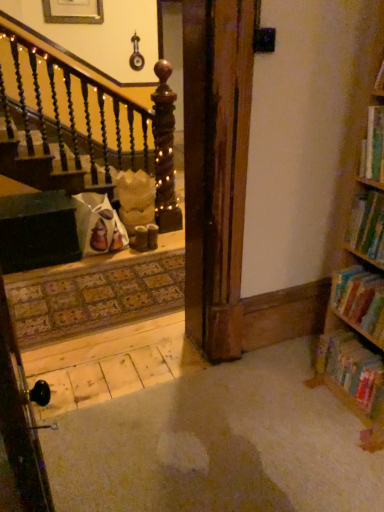
In order to face multicolored cardboard book at lower right, which is the 4th book from top to bottom, should I rotate leftwards or rightwards?

You should look right and rotate roughly 21.259 degrees.

What do you see at coordinates (367, 225) in the screenshot?
I see `green matte bookshelf at right, which is the third book from bottom to top` at bounding box center [367, 225].

Image resolution: width=384 pixels, height=512 pixels. Identify the location of multicolored cardboard book at lower right, arranged as the first book when ordered from the bottom. (351, 368).

The height and width of the screenshot is (512, 384). In order to click on book lying above the green matte bookshelf at right, which ranks as the second book in top-to-bottom order (from the image's perspective) in this screenshot , I will do `click(373, 146)`.

Who is shorter, hardcover book at upper right, the 4th book when ordered from bottom to top, or green matte bookshelf at right, which ranks as the second book in top-to-bottom order?

green matte bookshelf at right, which ranks as the second book in top-to-bottom order.

Could you measure the distance between hardcover book at upper right, the 4th book when ordered from bottom to top, and green matte bookshelf at right, which ranks as the second book in top-to-bottom order?

hardcover book at upper right, the 4th book when ordered from bottom to top, is 6.85 inches away from green matte bookshelf at right, which ranks as the second book in top-to-bottom order.

Which object is wider, hardcover book at upper right, the 4th book when ordered from bottom to top, or multicolored cardboard book at lower right, which is the 4th book from top to bottom?

multicolored cardboard book at lower right, which is the 4th book from top to bottom, is wider.

Would you say hardcover book at upper right, the 1th book viewed from the top, is a long distance from multicolored cardboard book at lower right, which is the 4th book from top to bottom?

They are positioned close to each other.

Is hardcover book at upper right, the 1th book viewed from the top, facing towards multicolored cardboard book at lower right, arranged as the first book when ordered from the bottom?

No, hardcover book at upper right, the 1th book viewed from the top, is not turned towards multicolored cardboard book at lower right, arranged as the first book when ordered from the bottom.

From the image's perspective, between hardcover book at upper right, the 1th book viewed from the top, and multicolored cardboard book at lower right, which is the 4th book from top to bottom, which one is located above?

hardcover book at upper right, the 1th book viewed from the top, from the image's perspective.

From a real-world perspective, is multicolored cardboard book at lower right, arranged as the first book when ordered from the bottom, beneath green matte bookshelf at right, which ranks as the second book in top-to-bottom order?

Indeed, from a real-world perspective, multicolored cardboard book at lower right, arranged as the first book when ordered from the bottom, is positioned beneath green matte bookshelf at right, which ranks as the second book in top-to-bottom order.

Is green matte bookshelf at right, which ranks as the second book in top-to-bottom order, completely or partially inside multicolored cardboard book at lower right, arranged as the first book when ordered from the bottom?

No, green matte bookshelf at right, which ranks as the second book in top-to-bottom order, is not inside multicolored cardboard book at lower right, arranged as the first book when ordered from the bottom.

Considering the points (342, 352) and (375, 200), which point is behind, point (342, 352) or point (375, 200)?

The point (342, 352) is farther.

Is green matte bookshelf at right, which ranks as the second book in top-to-bottom order, at the back of hardcover book at right, marked as the second book in a bottom-to-top arrangement?

hardcover book at right, marked as the second book in a bottom-to-top arrangement, does not have its back to green matte bookshelf at right, which ranks as the second book in top-to-bottom order.

From the image's perspective, between hardcover book at right, which appears as the 3th book when viewed from the top, and green matte bookshelf at right, which is the third book from bottom to top, who is located below?

hardcover book at right, which appears as the 3th book when viewed from the top, is shown below in the image.

Is hardcover book at right, which appears as the 3th book when viewed from the top, wider or thinner than green matte bookshelf at right, which ranks as the second book in top-to-bottom order?

hardcover book at right, which appears as the 3th book when viewed from the top, is wider than green matte bookshelf at right, which ranks as the second book in top-to-bottom order.

Which is in front, point (359, 300) or point (369, 197)?

The point (369, 197) is closer to the camera.

From the picture: Which point is more forward, (325, 356) or (379, 160)?

The point (379, 160) is in front.

Is multicolored cardboard book at lower right, arranged as the first book when ordered from the bottom, in front of or behind hardcover book at upper right, the 1th book viewed from the top, in the image?

Visually, multicolored cardboard book at lower right, arranged as the first book when ordered from the bottom, is located behind hardcover book at upper right, the 1th book viewed from the top.

Which is correct: multicolored cardboard book at lower right, arranged as the first book when ordered from the bottom, is inside hardcover book at upper right, the 4th book when ordered from bottom to top, or outside of it?

multicolored cardboard book at lower right, arranged as the first book when ordered from the bottom, is not inside hardcover book at upper right, the 4th book when ordered from bottom to top, it's outside.

Is multicolored cardboard book at lower right, which is the 4th book from top to bottom, at the left side of hardcover book at upper right, the 1th book viewed from the top?

Incorrect, multicolored cardboard book at lower right, which is the 4th book from top to bottom, is not on the left side of hardcover book at upper right, the 1th book viewed from the top.

Is hardcover book at right, marked as the second book in a bottom-to-top arrangement, turned away from multicolored cardboard book at lower right, which is the 4th book from top to bottom?

No, hardcover book at right, marked as the second book in a bottom-to-top arrangement, is not facing away from multicolored cardboard book at lower right, which is the 4th book from top to bottom.

This screenshot has height=512, width=384. In order to click on book below the hardcover book at right, marked as the second book in a bottom-to-top arrangement (from the image's perspective) in this screenshot , I will do `click(351, 368)`.

Which is behind, point (339, 306) or point (365, 409)?

The point (339, 306) is behind.

From a real-world perspective, is hardcover book at right, which appears as the 3th book when viewed from the top, above or below multicolored cardboard book at lower right, arranged as the first book when ordered from the bottom?

hardcover book at right, which appears as the 3th book when viewed from the top, is situated higher than multicolored cardboard book at lower right, arranged as the first book when ordered from the bottom, in the real world.

Is point (368, 194) closer or farther from the camera than point (380, 112)?

Point (368, 194).

What's the angular difference between green matte bookshelf at right, which ranks as the second book in top-to-bottom order, and hardcover book at upper right, the 4th book when ordered from bottom to top,'s facing directions?

They differ by 0.00109 degrees in their facing directions.

In the image, is green matte bookshelf at right, which ranks as the second book in top-to-bottom order, positioned in front of or behind hardcover book at upper right, the 4th book when ordered from bottom to top?

Clearly, green matte bookshelf at right, which ranks as the second book in top-to-bottom order, is behind hardcover book at upper right, the 4th book when ordered from bottom to top.

In the scene shown: From the image's perspective, between green matte bookshelf at right, which ranks as the second book in top-to-bottom order, and hardcover book at upper right, the 4th book when ordered from bottom to top, which one is located above?

hardcover book at upper right, the 4th book when ordered from bottom to top, appears higher in the image.

This screenshot has height=512, width=384. Find the location of `book that is the 1st one when counting downward from the hardcover book at upper right, the 1th book viewed from the top (from the image's perspective)`. book that is the 1st one when counting downward from the hardcover book at upper right, the 1th book viewed from the top (from the image's perspective) is located at coordinates (367, 225).

From a real-world perspective, which book is the 3rd one above the multicolored cardboard book at lower right, which is the 4th book from top to bottom? Please provide its 2D coordinates.

[(373, 146)]

When comparing their distances from hardcover book at upper right, the 4th book when ordered from bottom to top, does multicolored cardboard book at lower right, arranged as the first book when ordered from the bottom, or hardcover book at right, which appears as the 3th book when viewed from the top, seem closer?

Among the two, hardcover book at right, which appears as the 3th book when viewed from the top, is located nearer to hardcover book at upper right, the 4th book when ordered from bottom to top.

When comparing their distances from multicolored cardboard book at lower right, which is the 4th book from top to bottom, does hardcover book at right, marked as the second book in a bottom-to-top arrangement, or green matte bookshelf at right, which is the third book from bottom to top, seem closer?

hardcover book at right, marked as the second book in a bottom-to-top arrangement.

Looking at the image, which one is located further to hardcover book at right, which appears as the 3th book when viewed from the top, multicolored cardboard book at lower right, arranged as the first book when ordered from the bottom, or hardcover book at upper right, the 4th book when ordered from bottom to top?

hardcover book at upper right, the 4th book when ordered from bottom to top, is further to hardcover book at right, which appears as the 3th book when viewed from the top.

Looking at the image, which one is located further to multicolored cardboard book at lower right, arranged as the first book when ordered from the bottom, hardcover book at upper right, the 4th book when ordered from bottom to top, or hardcover book at right, marked as the second book in a bottom-to-top arrangement?

Based on the image, hardcover book at upper right, the 4th book when ordered from bottom to top, appears to be further to multicolored cardboard book at lower right, arranged as the first book when ordered from the bottom.

Based on their spatial positions, is hardcover book at upper right, the 1th book viewed from the top, or multicolored cardboard book at lower right, which is the 4th book from top to bottom, closer to green matte bookshelf at right, which ranks as the second book in top-to-bottom order?

hardcover book at upper right, the 1th book viewed from the top, is positioned closer to the anchor green matte bookshelf at right, which ranks as the second book in top-to-bottom order.

Which object lies nearer to the anchor point multicolored cardboard book at lower right, arranged as the first book when ordered from the bottom, green matte bookshelf at right, which ranks as the second book in top-to-bottom order, or hardcover book at right, marked as the second book in a bottom-to-top arrangement?

hardcover book at right, marked as the second book in a bottom-to-top arrangement.

Considering their positions, is green matte bookshelf at right, which ranks as the second book in top-to-bottom order, positioned closer to multicolored cardboard book at lower right, which is the 4th book from top to bottom, than hardcover book at upper right, the 1th book viewed from the top?

green matte bookshelf at right, which ranks as the second book in top-to-bottom order, is closer to multicolored cardboard book at lower right, which is the 4th book from top to bottom.

Estimate the real-world distances between objects in this image. Which object is further from green matte bookshelf at right, which ranks as the second book in top-to-bottom order, multicolored cardboard book at lower right, arranged as the first book when ordered from the bottom, or hardcover book at right, marked as the second book in a bottom-to-top arrangement?

The object further to green matte bookshelf at right, which ranks as the second book in top-to-bottom order, is multicolored cardboard book at lower right, arranged as the first book when ordered from the bottom.

This screenshot has width=384, height=512. Find the location of `book between green matte bookshelf at right, which is the third book from bottom to top, and multicolored cardboard book at lower right, which is the 4th book from top to bottom, in the vertical direction`. book between green matte bookshelf at right, which is the third book from bottom to top, and multicolored cardboard book at lower right, which is the 4th book from top to bottom, in the vertical direction is located at coordinates (360, 298).

Locate an element on the screen. book between hardcover book at upper right, the 1th book viewed from the top, and hardcover book at right, which appears as the 3th book when viewed from the top, from top to bottom is located at coordinates (367, 225).